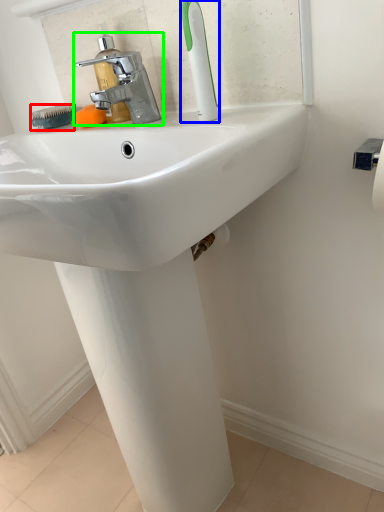
Question: Which object is the closest to the brush (highlighted by a red box)? Choose among these: toothbrush (highlighted by a blue box) or tap (highlighted by a green box).

Choices:
 (A) toothbrush
 (B) tap

Answer: (B)